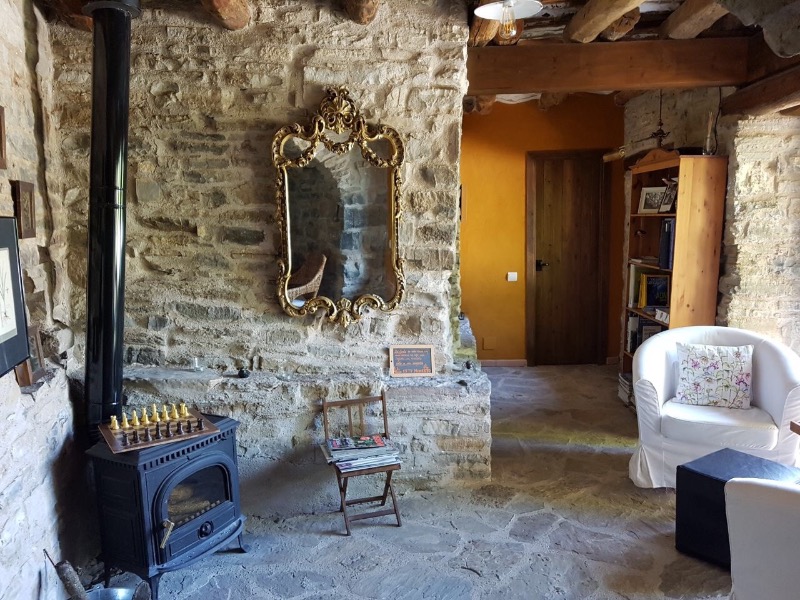
In order to click on wooden folding chair in this screenshot , I will do `click(388, 468)`.